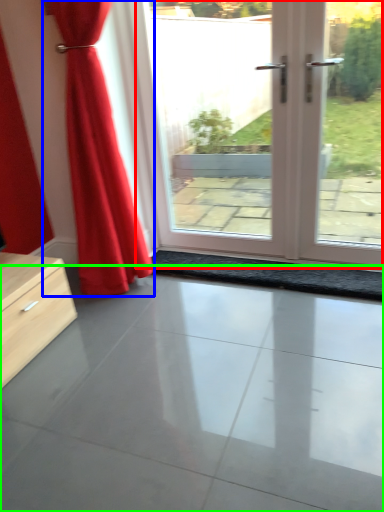
Question: Which object is the closest to the door (highlighted by a red box)? Choose among these: curtain (highlighted by a blue box) or concrete (highlighted by a green box).

Choices:
 (A) curtain
 (B) concrete

Answer: (A)